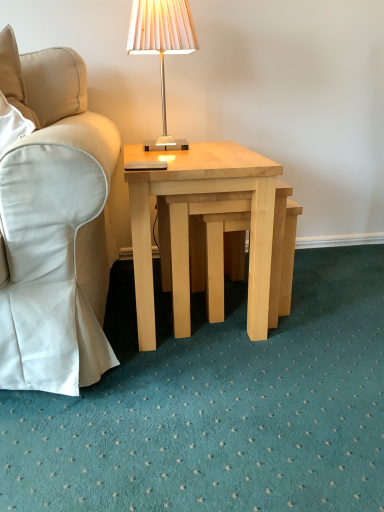
Question: Is light wood step stool at center wider than light wood/natural wood coffee table at center?

Choices:
 (A) no
 (B) yes

Answer: (A)

Question: From the image's perspective, does light wood step stool at center appear higher than light wood/natural wood coffee table at center?

Choices:
 (A) yes
 (B) no

Answer: (B)

Question: Is light wood step stool at center located outside light wood/natural wood coffee table at center?

Choices:
 (A) no
 (B) yes

Answer: (A)

Question: Is the depth of light wood step stool at center greater than that of light wood/natural wood coffee table at center?

Choices:
 (A) yes
 (B) no

Answer: (A)

Question: From a real-world perspective, is light wood step stool at center under light wood/natural wood coffee table at center?

Choices:
 (A) yes
 (B) no

Answer: (A)

Question: Considering the positions of point (228, 230) and point (74, 263), is point (228, 230) closer or farther from the camera than point (74, 263)?

Choices:
 (A) farther
 (B) closer

Answer: (A)

Question: Do you think light wood step stool at center is within beige fabric chair at left, or outside of it?

Choices:
 (A) inside
 (B) outside

Answer: (B)

Question: Based on their sizes in the image, would you say light wood step stool at center is bigger or smaller than beige fabric chair at left?

Choices:
 (A) big
 (B) small

Answer: (A)

Question: In the image, is light wood step stool at center positioned in front of or behind beige fabric chair at left?

Choices:
 (A) front
 (B) behind

Answer: (B)

Question: From the image's perspective, is beige fabric chair at left above or below light wood/natural wood coffee table at center?

Choices:
 (A) above
 (B) below

Answer: (A)

Question: Choose the correct answer: Is beige fabric chair at left inside light wood/natural wood coffee table at center or outside it?

Choices:
 (A) outside
 (B) inside

Answer: (A)

Question: Is point (13, 96) positioned closer to the camera than point (190, 143)?

Choices:
 (A) farther
 (B) closer

Answer: (B)

Question: Visually, is beige fabric chair at left positioned to the left or to the right of light wood/natural wood coffee table at center?

Choices:
 (A) left
 (B) right

Answer: (A)

Question: Relative to light wood step stool at center, is matte white lampshade at upper center in front or behind?

Choices:
 (A) front
 (B) behind

Answer: (B)

Question: Would you say matte white lampshade at upper center is inside or outside light wood step stool at center?

Choices:
 (A) inside
 (B) outside

Answer: (B)